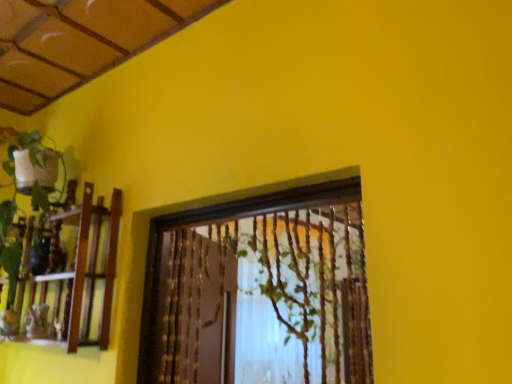
The height and width of the screenshot is (384, 512). Describe the element at coordinates (67, 275) in the screenshot. I see `wooden shelf at left` at that location.

You are a GUI agent. You are given a task and a screenshot of the screen. Output one action in this format:
    pyautogui.click(x=<x>, y=<y>)
    Task: Click on the wooden shelf at left
    The image size is (512, 384).
    Given the screenshot: What is the action you would take?
    [x=67, y=275]

Measure the distance between point [91,250] and camera.

The distance of point [91,250] from camera is 5.40 feet.

I want to click on wooden shelf at left, so click(67, 275).